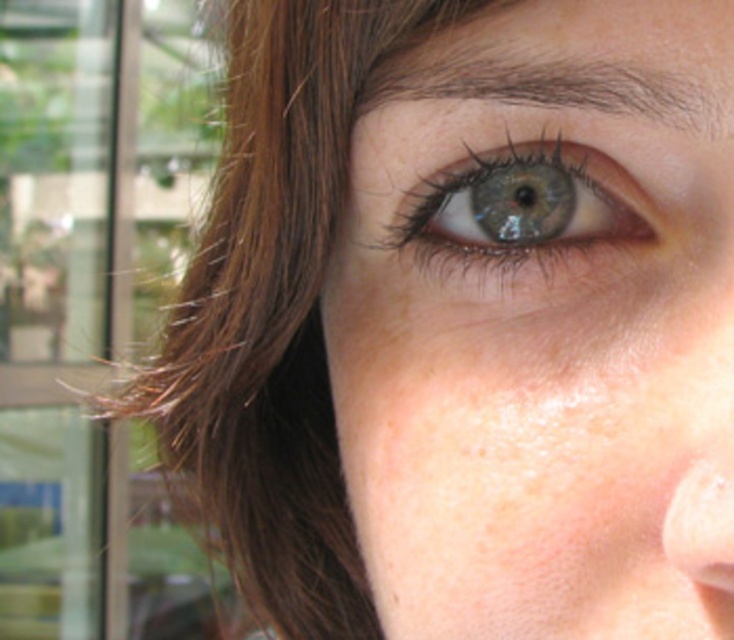
Can you confirm if smooth skin eye at center is taller than blue glossy eye at center?

Yes.

Can you confirm if smooth skin eye at center is positioned above blue glossy eye at center?

Actually, smooth skin eye at center is below blue glossy eye at center.

Which is behind, point (619, 202) or point (534, 186)?

Positioned behind is point (534, 186).

Find the location of a particular element. Image resolution: width=734 pixels, height=640 pixels. smooth skin eye at center is located at coordinates (542, 324).